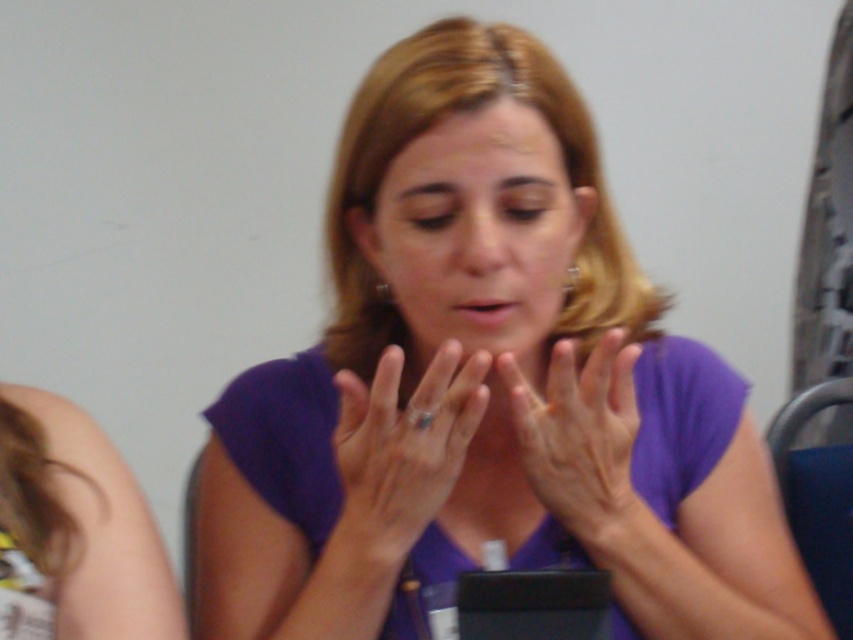
From the picture: You are a photographer setting up a camera to capture the scene. The camera has a focus ring that can only focus on objects at a certain height. If you want to ensure both the purple matte face at center and the matte gold ring at center are in focus, which object should you adjust the focus to prioritize based on their vertical positions?

The purple matte face at center is above the matte gold ring at center. To ensure both are in focus, prioritize focusing on the purple matte face at center since it is higher up, and the ring will naturally fall into the depth of field below it.

You are a jeweler observing the scene. You need to place a new ring on the dry skin hands at center. According to the current position of the matte gold ring at center, where should you place the new ring to avoid overlapping?

The matte gold ring at center is already to the left of dry skin hands at center, so placing the new ring to the right of dry skin hands at center would avoid overlapping.